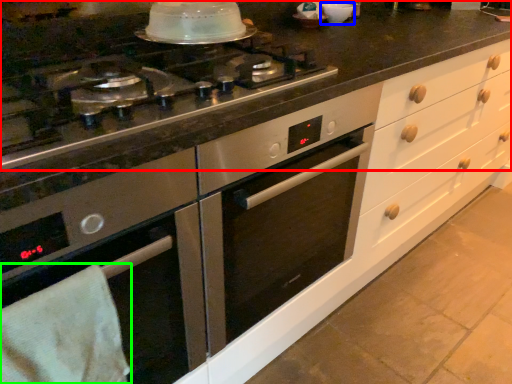
Question: Considering the real-world distances, which object is farthest from countertop (highlighted by a red box)? appliance (highlighted by a blue box) or material (highlighted by a green box)?

Choices:
 (A) appliance
 (B) material

Answer: (B)